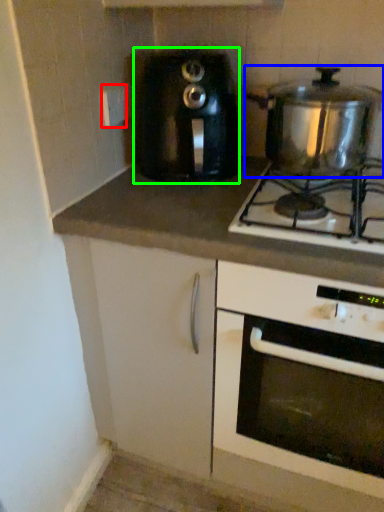
Question: Considering the real-world distances, which object is farthest from electric outlet (highlighted by a red box)? kitchen appliance (highlighted by a blue box) or toaster (highlighted by a green box)?

Choices:
 (A) kitchen appliance
 (B) toaster

Answer: (A)